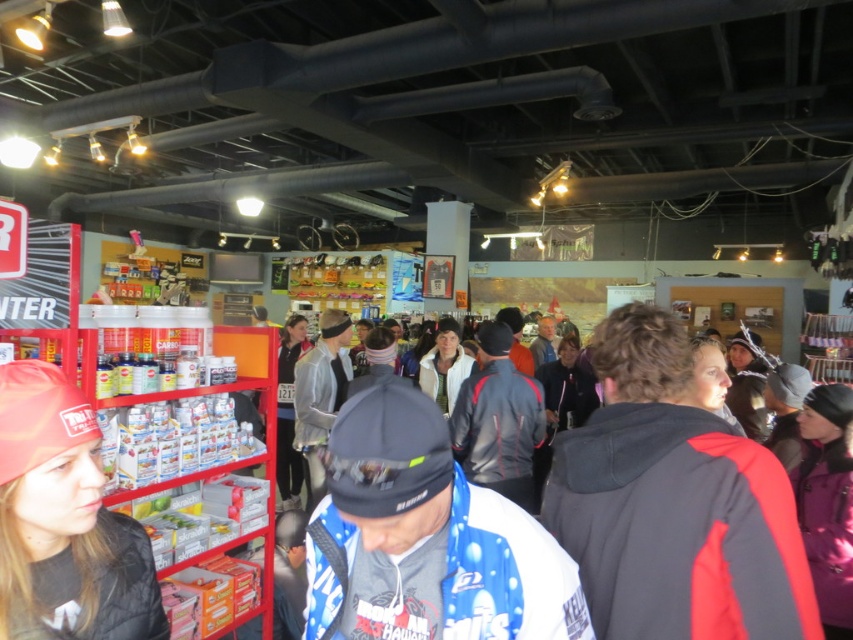
Question: Can you confirm if black/red jacket at center-right is positioned below blue fleece jacket at center?

Choices:
 (A) no
 (B) yes

Answer: (A)

Question: Among these objects, which one is farthest from the camera?

Choices:
 (A) black/red jacket at center-right
 (B) blue fleece jacket at center

Answer: (A)

Question: Is black/red jacket at center-right smaller than blue fleece jacket at center?

Choices:
 (A) yes
 (B) no

Answer: (B)

Question: Which object is the farthest from the red knit cap at left?

Choices:
 (A) black/red jacket at center-right
 (B) blue fleece jacket at center

Answer: (A)

Question: Considering the real-world distances, which object is farthest from the blue fleece jacket at center?

Choices:
 (A) black/red jacket at center-right
 (B) red knit cap at left

Answer: (B)

Question: Is black/red jacket at center-right closer to camera compared to blue fleece jacket at center?

Choices:
 (A) no
 (B) yes

Answer: (A)